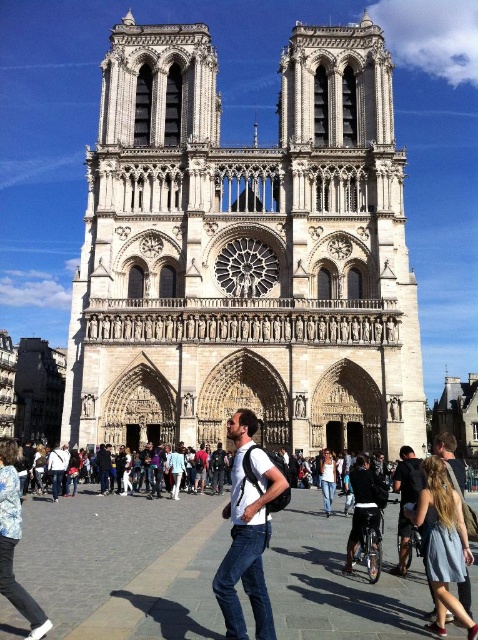
Is point (239, 634) farther from viewer compared to point (332, 477)?

That is False.

Is white matte shirt at center below denim jeans at center?

No.

Does point (231, 580) come closer to viewer compared to point (324, 483)?

Yes, point (231, 580) is in front of point (324, 483).

Where is `white matte shirt at center`? white matte shirt at center is located at coordinates (249, 529).

Measure the distance between point (142, 429) and camera.

A distance of 197.64 feet exists between point (142, 429) and camera.

Measure the distance between white stone cathedral at center and white matte shirt at center.

82.98 feet

Which is behind, point (316, 378) or point (264, 472)?

Positioned behind is point (316, 378).

Identify the location of white stone cathedral at center. (245, 252).

You are a GUI agent. You are given a task and a screenshot of the screen. Output one action in this format:
    pyautogui.click(x=<x>, y=<y>)
    Task: Click on the black matte jacket at center
    The image size is (478, 640).
    Given the screenshot: What is the action you would take?
    [364, 506]

Is black matte jacket at center shorter than denim jeans at center?

In fact, black matte jacket at center may be taller than denim jeans at center.

This screenshot has height=640, width=478. What do you see at coordinates (364, 506) in the screenshot?
I see `black matte jacket at center` at bounding box center [364, 506].

Image resolution: width=478 pixels, height=640 pixels. What are the coordinates of `black matte jacket at center` in the screenshot? It's located at (364, 506).